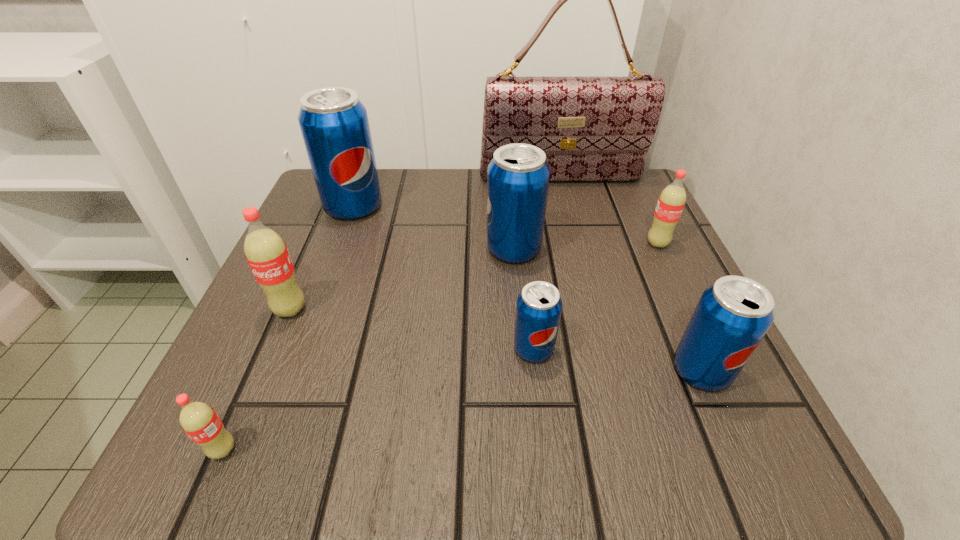
This screenshot has width=960, height=540. In the image, there is a desktop. In order to click on vacant space at the left edge in this screenshot , I will do `click(352, 246)`.

You are a GUI agent. You are given a task and a screenshot of the screen. Output one action in this format:
    pyautogui.click(x=<x>, y=<y>)
    Task: Click on the free space at the right edge of the desktop
    The height and width of the screenshot is (540, 960).
    Given the screenshot: What is the action you would take?
    pyautogui.click(x=683, y=393)

This screenshot has width=960, height=540. Find the location of `vacant region at the near left corner of the desktop`. vacant region at the near left corner of the desktop is located at coordinates (239, 417).

Identify the location of vacant space at the far right corner of the desktop. (613, 192).

In the image, there is a desktop. In order to click on vacant space at the near right corner in this screenshot , I will do `click(765, 412)`.

This screenshot has width=960, height=540. I want to click on empty space that is in between the third biggest blue pop soda and the smallest red soda, so pos(462,410).

You are a GUI agent. You are given a task and a screenshot of the screen. Output one action in this format:
    pyautogui.click(x=<x>, y=<y>)
    Task: Click on the free spot between the nearest soda and the rightmost red soda
    The image size is (960, 540).
    Given the screenshot: What is the action you would take?
    pyautogui.click(x=441, y=347)

Identify the location of vacant space that is in between the third nearest blue pop soda and the seventh nearest object. (434, 228).

What are the coordinates of `empty space that is in between the smallest red soda and the farthest blue pop soda` in the screenshot? It's located at (288, 328).

Locate an element on the screen. free spot between the second smallest blue pop soda and the brown handbag is located at coordinates (631, 274).